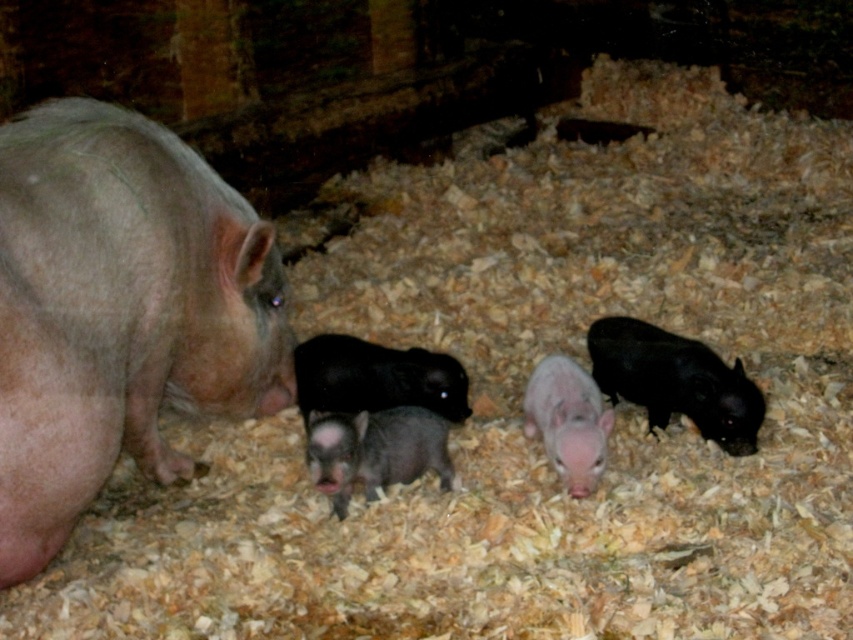
Does pink matte pig at left have a greater width compared to smooth pink piglet at center?

Yes, pink matte pig at left is wider than smooth pink piglet at center.

In order to click on pink matte pig at left in this screenshot , I will do `click(119, 310)`.

This screenshot has height=640, width=853. I want to click on pink matte pig at left, so click(119, 310).

Looking at this image, is black matte piglet at right further to the viewer compared to smooth pink piglet at center?

Yes, it is behind smooth pink piglet at center.

Which is above, black matte piglet at right or smooth pink piglet at center?

black matte piglet at right is higher up.

Which is in front, point (624, 317) or point (549, 403)?

Point (549, 403)

Find the location of `black matte piglet at right`. black matte piglet at right is located at coordinates (675, 380).

Based on the photo, who is lower down, pink matte pig at left or black matte piglet at right?

black matte piglet at right

How distant is pink matte pig at left from black matte piglet at right?

pink matte pig at left and black matte piglet at right are 1.35 meters apart from each other.

This screenshot has width=853, height=640. I want to click on pink matte pig at left, so click(119, 310).